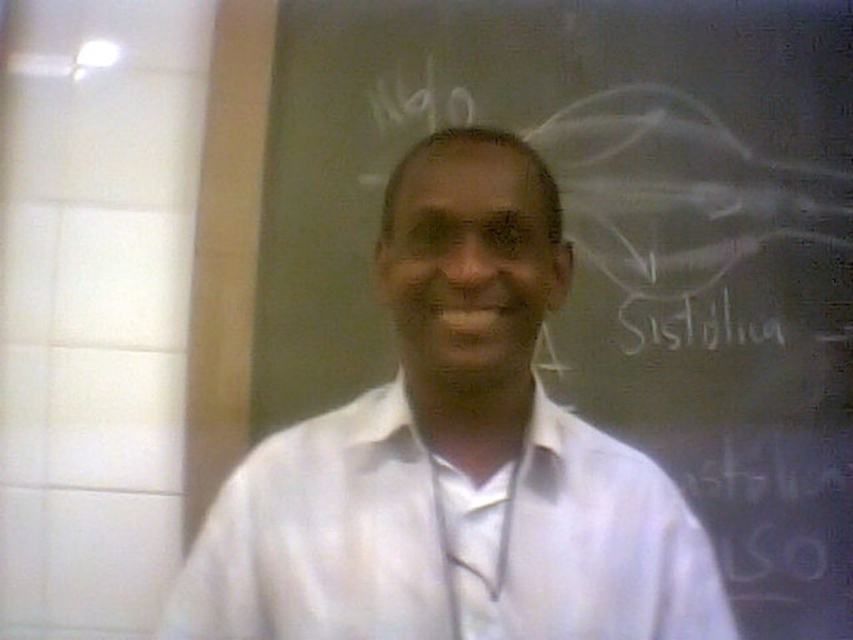
Which is behind, point (354, 19) or point (419, 497)?

The point (354, 19) is behind.

I want to click on blackboard at center, so click(612, 243).